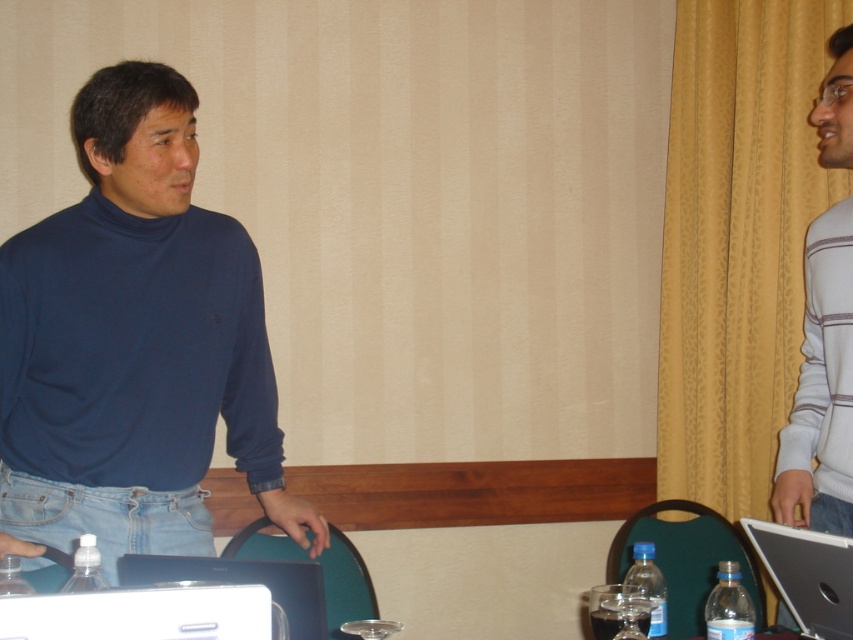
Question: Which point appears farthest from the camera in this image?

Choices:
 (A) (190, 573)
 (B) (827, 220)
 (C) (665, 413)

Answer: (C)

Question: Is gray striped sweater at right wider than white plastic laptop at lower left?

Choices:
 (A) yes
 (B) no

Answer: (B)

Question: Which object is the farthest from the white plastic laptop at lower left?

Choices:
 (A) matte blue turtleneck sweater at left
 (B) black glossy laptop at lower left
 (C) yellow textured curtain at upper right
 (D) silver metallic laptop at lower right

Answer: (C)

Question: Is yellow textured curtain at upper right to the left of gray striped sweater at right from the viewer's perspective?

Choices:
 (A) no
 (B) yes

Answer: (A)

Question: Can you confirm if matte blue turtleneck sweater at left is smaller than silver metallic laptop at lower right?

Choices:
 (A) no
 (B) yes

Answer: (A)

Question: Which point appears farthest from the camera in this image?

Choices:
 (A) (180, 528)
 (B) (798, 212)
 (C) (149, 561)
 (D) (779, 528)

Answer: (B)